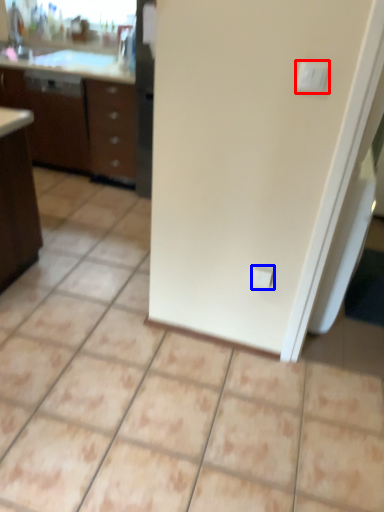
Question: Which object appears farthest to the camera in this image, light switch (highlighted by a red box) or electric outlet (highlighted by a blue box)?

Choices:
 (A) light switch
 (B) electric outlet

Answer: (B)